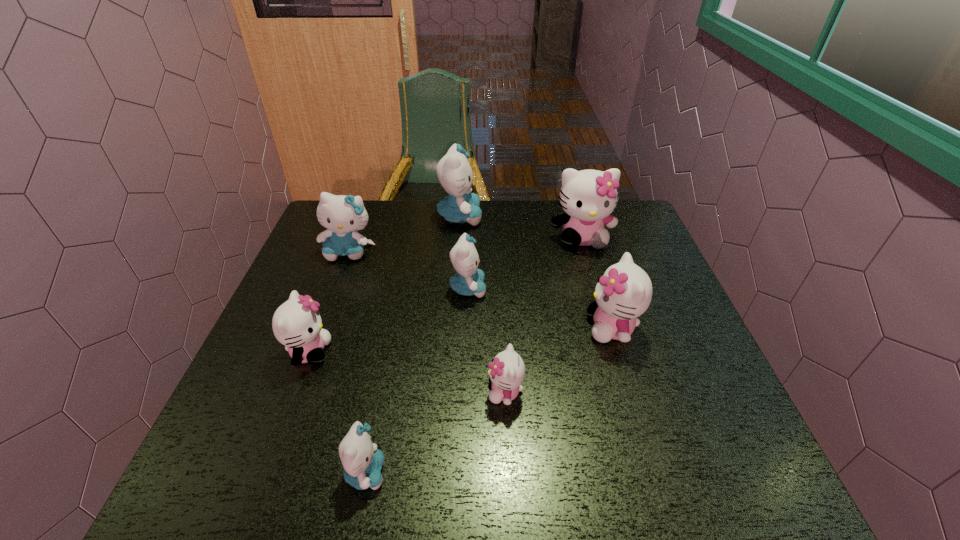
You are a GUI agent. You are given a task and a screenshot of the screen. Output one action in this format:
    pyautogui.click(x=<x>, y=<y>)
    Task: Click on the farthest blue kitten
    
    Given the screenshot: What is the action you would take?
    pyautogui.click(x=454, y=172)

Find the location of `the biggest white kitten`. the biggest white kitten is located at coordinates (588, 197).

Find the location of a particular element. the second biggest white kitten is located at coordinates (624, 292).

Identify the location of the second farthest blue kitten. (342, 215).

What are the coordinates of `the leftmost blue kitten` in the screenshot? It's located at (x=342, y=215).

At what (x,y) coordinates should I click in order to perform the action: click on the second smallest blue kitten. Please return your answer as a coordinate pair (x, y). The image size is (960, 540). Looking at the image, I should click on (468, 281).

Identify the location of the leftmost white kitten. The height and width of the screenshot is (540, 960). (296, 324).

Find the location of a particular element. the third white kitten from right to left is located at coordinates (507, 370).

The width and height of the screenshot is (960, 540). Find the location of `the sixth object from right to left`. the sixth object from right to left is located at coordinates (362, 461).

Find the location of a particular element. the nearest object is located at coordinates (362, 461).